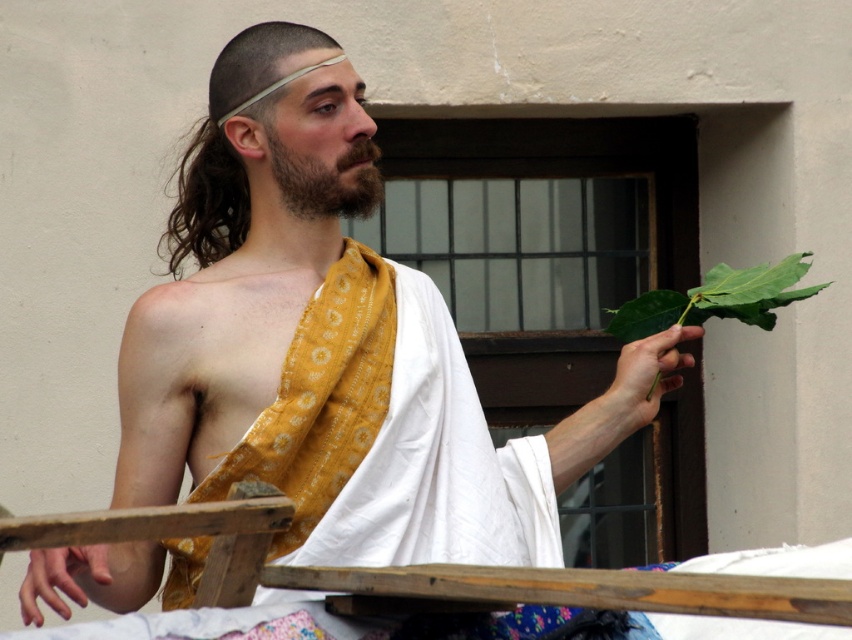
You are an event organizer planning a historical reenactment. You have two props available for the performer to hold or wear. The wooden at lower center and the green leafy stem at right. Which prop is wider in terms of physical width?

The wooden at lower center is wider than the green leafy stem at right.

You are an artist sketching this historical figure. You notice the dark brown thick beard at center and the green leafy stem at right. Which object is covering the other?

The dark brown thick beard at center is positioned over the green leafy stem at right, so it is covering it.

You are an artist sketching this historical figure. You need to decide which object to draw first based on their size. Which one should you start with, the dark brown thick beard at center or the green leafy stem at right?

The dark brown thick beard at center occupies less space than the green leafy stem at right, so you should start with the green leafy stem at right since it is larger and might require more detailed work first.